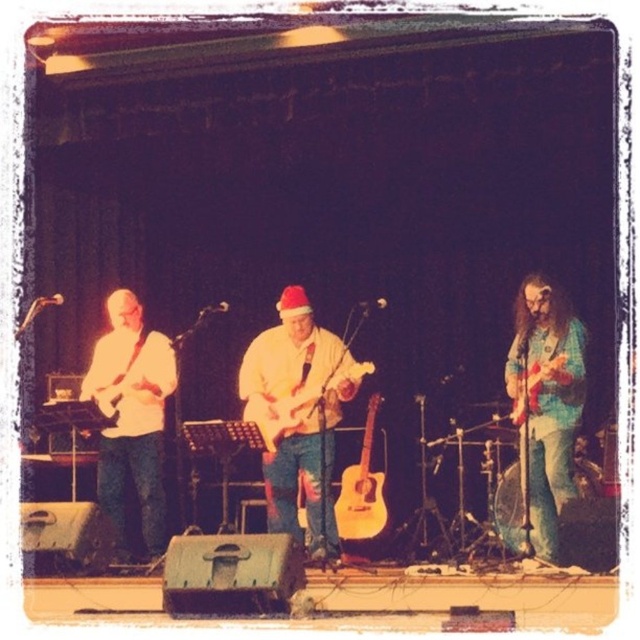
You are a stagehand and need to place a new microphone stand exactly at the center of the stage. The stage has a coordinate system where the bottom left corner is the origin point. The white matte guitar at center is represented by point (298, 416). Where should you place the microphone stand to ensure it is centered?

The white matte guitar at center is represented by point (298, 416), so the microphone stand should be placed at the same coordinates to ensure it is centered.

You are a stagehand who needs to transport both the white matte guitar at center and the white matte guitar at left. Which guitar requires a larger carrying case?

The white matte guitar at center requires a larger carrying case because it is larger in size than the white matte guitar at left.